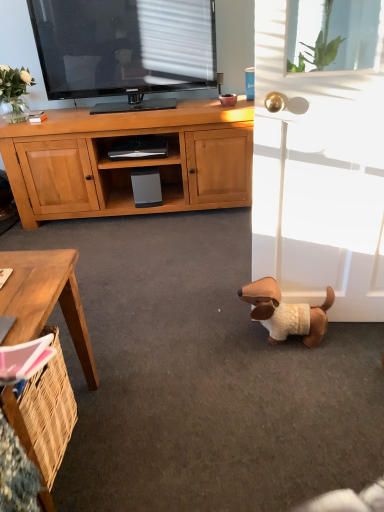
Locate an element on the screen. vacant area that lies between white matte screen door at lower right and brown plush dog at lower right is located at coordinates (352, 337).